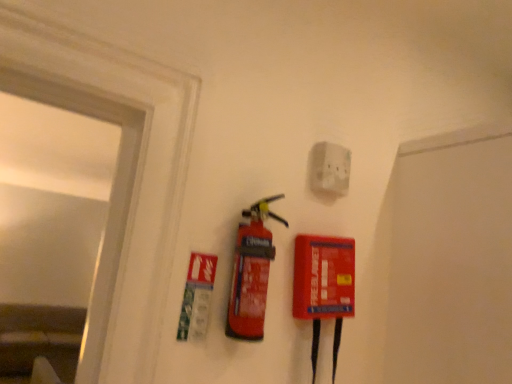
Question: Considering the positions of red matte fire extinguisher at center and white matte electric outlet at upper center in the image, is red matte fire extinguisher at center bigger or smaller than white matte electric outlet at upper center?

Choices:
 (A) big
 (B) small

Answer: (A)

Question: From the image's perspective, is red matte fire extinguisher at center above or below white matte electric outlet at upper center?

Choices:
 (A) above
 (B) below

Answer: (B)

Question: In terms of height, does red matte fire extinguisher at center look taller or shorter compared to white matte electric outlet at upper center?

Choices:
 (A) short
 (B) tall

Answer: (B)

Question: From a real-world perspective, is white matte electric outlet at upper center physically located above or below red matte fire extinguisher at center?

Choices:
 (A) above
 (B) below

Answer: (A)

Question: Does point (331, 158) appear closer or farther from the camera than point (252, 256)?

Choices:
 (A) farther
 (B) closer

Answer: (A)

Question: Is white matte electric outlet at upper center to the left or to the right of red matte fire extinguisher at center in the image?

Choices:
 (A) left
 (B) right

Answer: (B)

Question: From the image's perspective, is white matte electric outlet at upper center located above or below red matte fire extinguisher at center?

Choices:
 (A) above
 (B) below

Answer: (A)